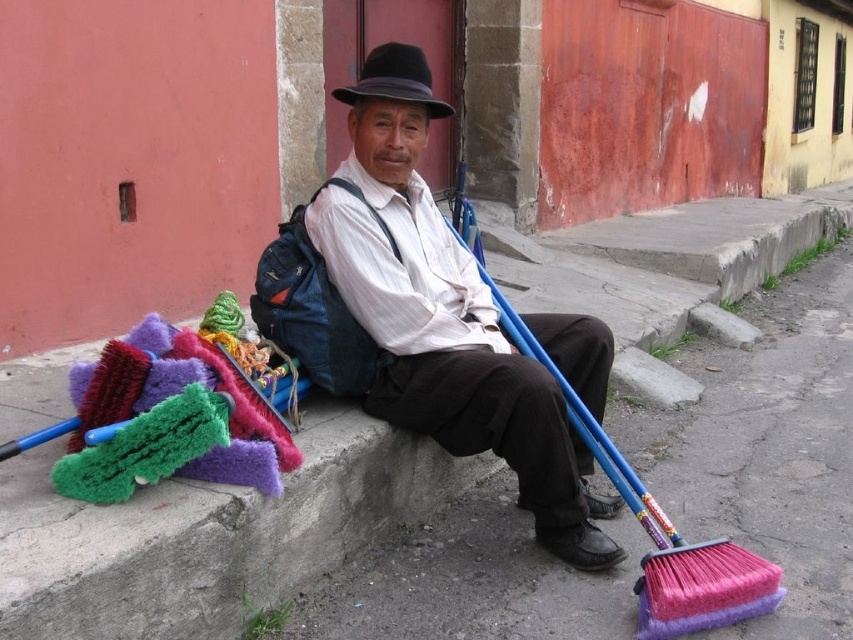
You are a fashion designer observing the man in the scene. You need to determine which item of his clothing has a greater width between the matte white shirt at center and the black felt fedora at center. Which one is wider?

The matte white shirt at center is wider than the black felt fedora at center according to the description provided.

You are a passerby who notices the matte white shirt at center and the black felt fedora at center. Which item is located to the right of the other?

The matte white shirt at center is positioned on the right side of black felt fedora at center, so the matte white shirt at center is to the right of the black felt fedora at center.

You are a delivery person who needs to pick up the pink bristle broom at lower right. The matte white shirt at center is blocking your path. Can you move the broom without moving the shirt?

The pink bristle broom at lower right is behind the matte white shirt at center, so you can reach and move the broom without needing to move the shirt.